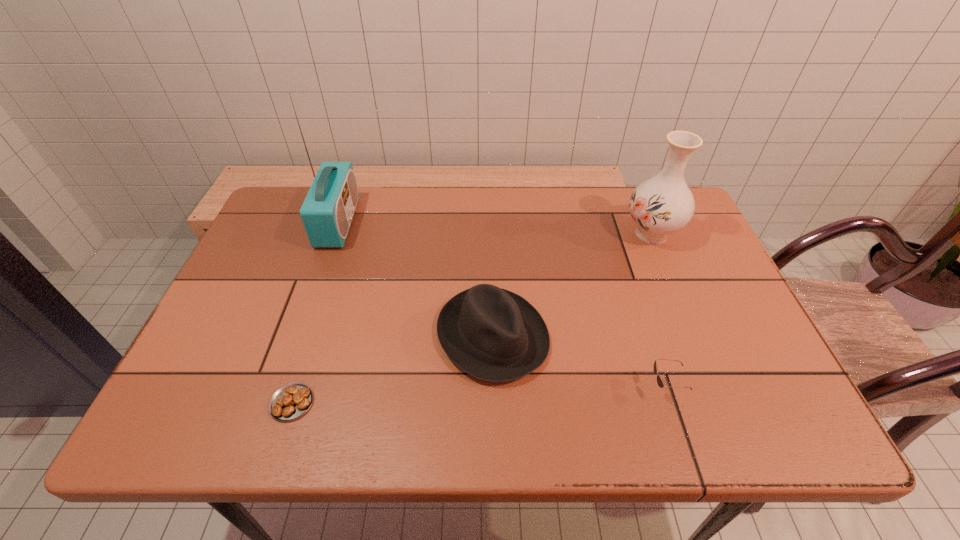
Where is `object at the far right corner`? The height and width of the screenshot is (540, 960). object at the far right corner is located at coordinates (663, 204).

The image size is (960, 540). In the image, there is a desktop. Find the location of `vacant area at the far edge`. vacant area at the far edge is located at coordinates (615, 190).

At what (x,y) coordinates should I click in order to perform the action: click on vacant space at the near edge of the desktop. Please return your answer as a coordinate pair (x, y). The width and height of the screenshot is (960, 540). Looking at the image, I should click on (634, 400).

In order to click on free space at the left edge of the desktop in this screenshot , I will do `click(284, 305)`.

I want to click on vacant space at the right edge of the desktop, so pyautogui.click(x=676, y=258).

You are a GUI agent. You are given a task and a screenshot of the screen. Output one action in this format:
    pyautogui.click(x=<x>, y=<y>)
    Task: Click on the free point at the near left corner
    This screenshot has width=960, height=540.
    Given the screenshot: What is the action you would take?
    pyautogui.click(x=187, y=430)

You are a GUI agent. You are given a task and a screenshot of the screen. Output one action in this format:
    pyautogui.click(x=<x>, y=<y>)
    Task: Click on the free location at the near right corner
    The width and height of the screenshot is (960, 540).
    Given the screenshot: What is the action you would take?
    pyautogui.click(x=780, y=426)

Where is `vacant space in between the third object from right to left and the pastry`? The image size is (960, 540). vacant space in between the third object from right to left and the pastry is located at coordinates (393, 369).

In order to click on free space between the third object from left to right and the fourth tallest object in this screenshot , I will do `click(579, 362)`.

Image resolution: width=960 pixels, height=540 pixels. I want to click on free spot between the third object from right to left and the fourth shortest object, so click(x=572, y=285).